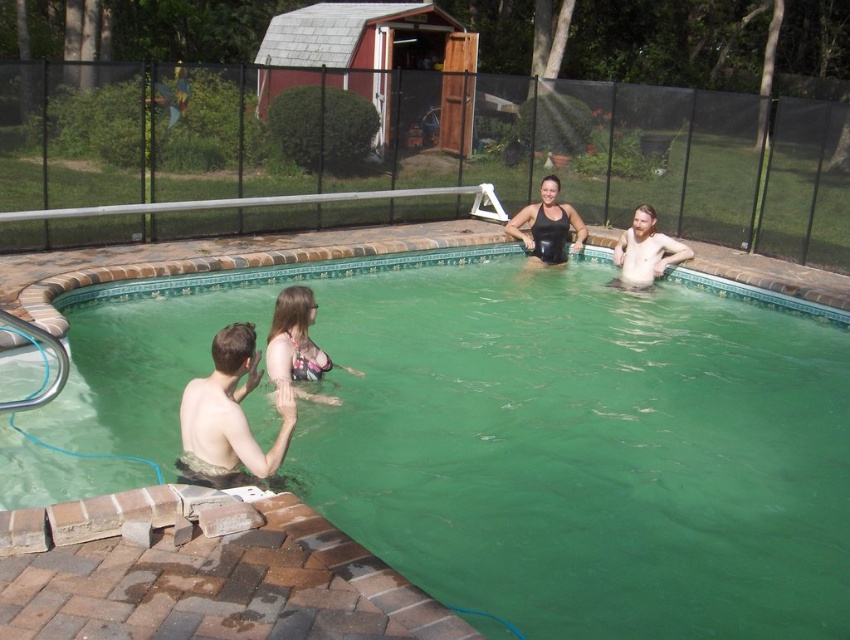
You are a photographer trying to capture a photo of both the skinny white man at lower left and the patterned bikini top at center. Since you want to focus on both subjects equally, which one should you adjust your camera to prioritize focusing on first?

The skinny white man at lower left is closer to the viewer than the patterned bikini top at center, so you should prioritize focusing on the skinny white man at lower left first to ensure both are in focus.

You are a photographer taking a picture of the backyard scene. You notice the green smooth water at center and the patterned bikini top at center. Which object is positioned lower in the image?

The green smooth water at center is located below the patterned bikini top at center, so it is positioned lower in the image.